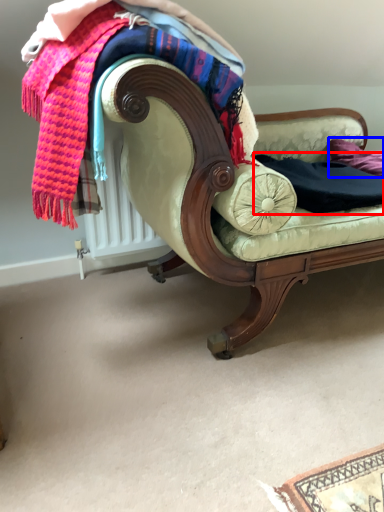
Question: Which object is closer to the camera taking this photo, clothing (highlighted by a red box) or pillow (highlighted by a blue box)?

Choices:
 (A) clothing
 (B) pillow

Answer: (A)